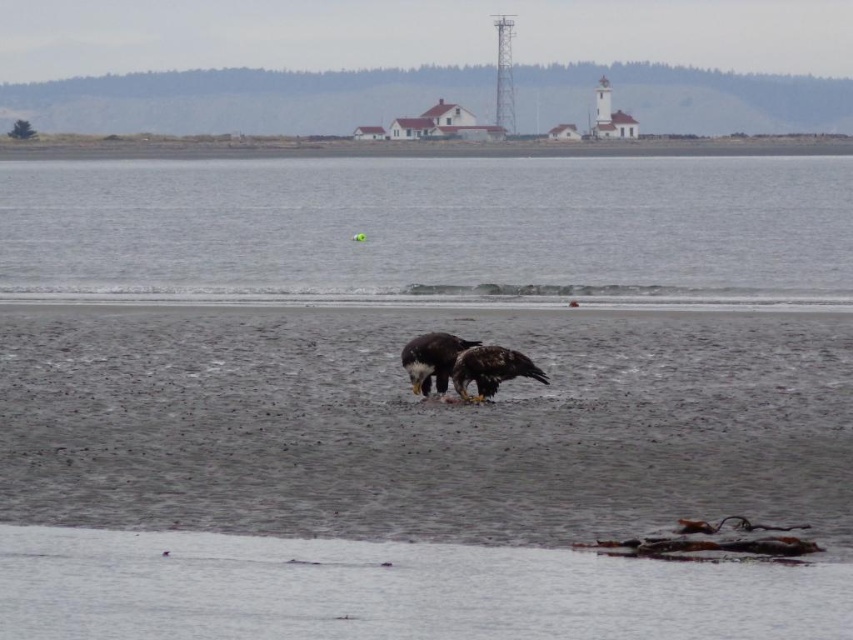
Who is lower down, brown feathered eagle at center or white feathers eagle at center?

brown feathered eagle at center is lower down.

Can you confirm if brown feathered eagle at center is wider than white feathers eagle at center?

Yes, brown feathered eagle at center is wider than white feathers eagle at center.

Measure the distance between point (480,355) and camera.

Point (480,355) is 15.89 meters away from camera.

At what (x,y) coordinates should I click in order to perform the action: click on brown feathered eagle at center. Please return your answer as a coordinate pair (x, y). This screenshot has width=853, height=640. Looking at the image, I should click on (490, 369).

Is gray matte water at center positioned behind white feathers eagle at center?

That is True.

Consider the image. Between gray matte water at center and white feathers eagle at center, which one has more height?

With more height is gray matte water at center.

Image resolution: width=853 pixels, height=640 pixels. I want to click on gray matte water at center, so click(432, 228).

Is gray matte water at center thinner than brown feathered eagle at center?

No.

Is point (503, 269) positioned after point (492, 356)?

That is True.

You are a GUI agent. You are given a task and a screenshot of the screen. Output one action in this format:
    pyautogui.click(x=<x>, y=<y>)
    Task: Click on the gray matte water at center
    The width and height of the screenshot is (853, 640).
    Given the screenshot: What is the action you would take?
    pyautogui.click(x=432, y=228)